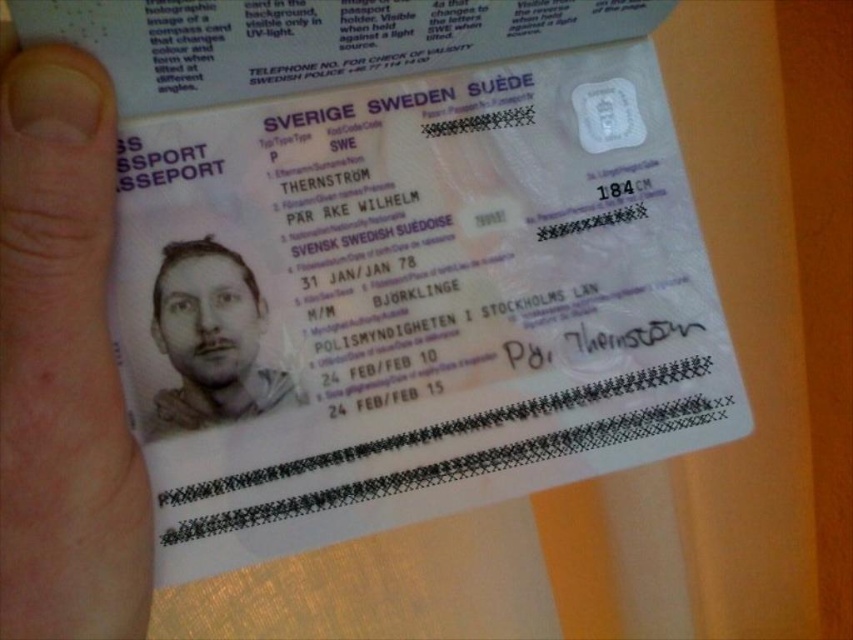
Image resolution: width=853 pixels, height=640 pixels. Describe the element at coordinates (62, 364) in the screenshot. I see `skin at upper left` at that location.

Who is taller, skin at upper left or gray matte portrait at center?

With more height is skin at upper left.

Where is `skin at upper left`? This screenshot has width=853, height=640. skin at upper left is located at coordinates (62, 364).

At what (x,y) coordinates should I click in order to perform the action: click on skin at upper left. Please return your answer as a coordinate pair (x, y). Looking at the image, I should click on click(62, 364).